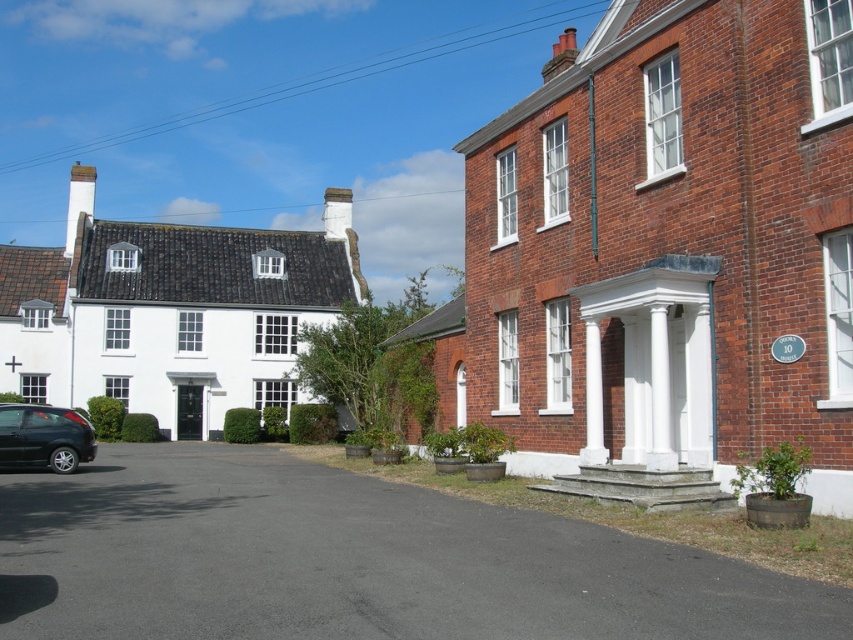
Who is more forward, (357, 618) or (39, 413)?

Point (357, 618) is in front.

Looking at this image, is the position of black asphalt driveway at lower left more distant than that of shiny black car at lower left?

That is False.

Which is in front, point (496, 620) or point (80, 458)?

Point (496, 620) is in front.

Identify the location of black asphalt driveway at lower left. (352, 561).